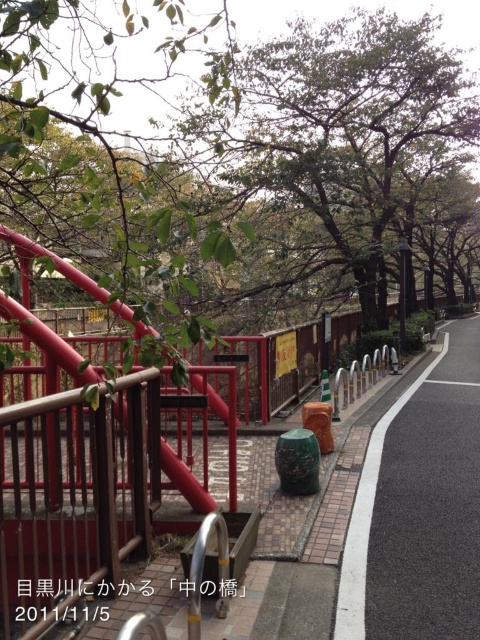
Does green leafy tree at center appear on the right side of red matte railing at center?

Yes, green leafy tree at center is to the right of red matte railing at center.

Which is more to the left, green leafy tree at center or red matte railing at center?

red matte railing at center

Which is in front, point (361, 28) or point (38, 401)?

Point (38, 401) is in front.

Where is `green leafy tree at center`? This screenshot has height=640, width=480. green leafy tree at center is located at coordinates (332, 136).

Can you confirm if green leafy tree at center is positioned to the left of asphalt at lower right?

Correct, you'll find green leafy tree at center to the left of asphalt at lower right.

Is the position of green leafy tree at center less distant than that of asphalt at lower right?

That is True.

The height and width of the screenshot is (640, 480). What are the coordinates of `green leafy tree at center` in the screenshot? It's located at (332, 136).

Image resolution: width=480 pixels, height=640 pixels. I want to click on green leafy tree at center, so click(332, 136).

Looking at this image, between asphalt at lower right and red matte railing at center, which one has more height?

Standing taller between the two is red matte railing at center.

Who is more forward, (402,616) or (19,541)?

Point (19,541) is in front.

Locate an element on the screen. The width and height of the screenshot is (480, 640). asphalt at lower right is located at coordinates (420, 508).